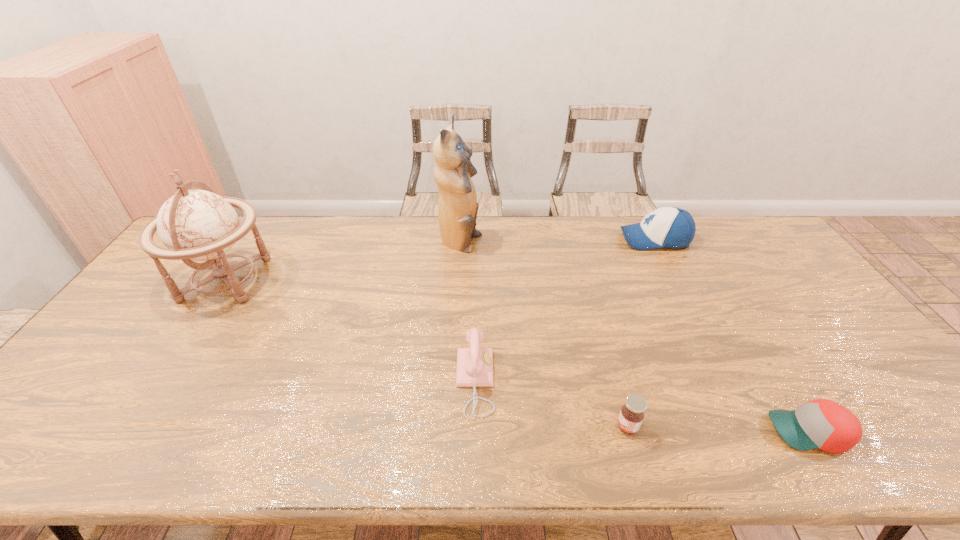
The width and height of the screenshot is (960, 540). I want to click on the fourth closest object to the shorter baseball cap, so click(x=457, y=207).

Where is `object that is the closest to the telephone`? Image resolution: width=960 pixels, height=540 pixels. object that is the closest to the telephone is located at coordinates pos(631,415).